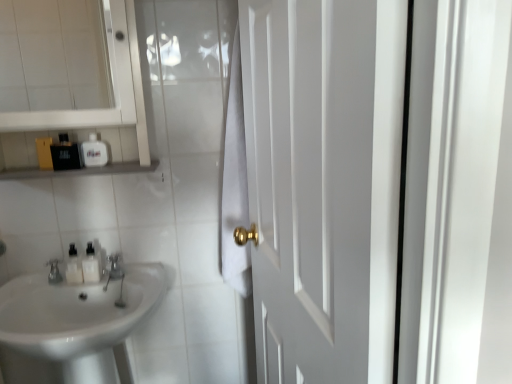
Question: Is matte silver faucet at lower left surrounded by brushed metal faucet at lower left?

Choices:
 (A) no
 (B) yes

Answer: (A)

Question: From a real-world perspective, is brushed metal faucet at lower left below matte silver faucet at lower left?

Choices:
 (A) yes
 (B) no

Answer: (A)

Question: Is there a large distance between brushed metal faucet at lower left and matte silver faucet at lower left?

Choices:
 (A) yes
 (B) no

Answer: (B)

Question: Is the depth of brushed metal faucet at lower left greater than that of matte silver faucet at lower left?

Choices:
 (A) no
 (B) yes

Answer: (B)

Question: Does brushed metal faucet at lower left have a greater height compared to matte silver faucet at lower left?

Choices:
 (A) no
 (B) yes

Answer: (B)

Question: Is matte silver faucet at lower left at the back of brushed metal faucet at lower left?

Choices:
 (A) no
 (B) yes

Answer: (A)

Question: Is white matte door at right outside black plastic container at upper left?

Choices:
 (A) no
 (B) yes

Answer: (B)

Question: From a real-world perspective, is white matte door at right positioned over black plastic container at upper left based on gravity?

Choices:
 (A) yes
 (B) no

Answer: (B)

Question: Is white matte door at right at the right side of black plastic container at upper left?

Choices:
 (A) yes
 (B) no

Answer: (A)

Question: Does white matte door at right have a greater width compared to black plastic container at upper left?

Choices:
 (A) no
 (B) yes

Answer: (A)

Question: Is white matte door at right smaller than black plastic container at upper left?

Choices:
 (A) no
 (B) yes

Answer: (A)

Question: Can you confirm if white matte door at right is shorter than black plastic container at upper left?

Choices:
 (A) yes
 (B) no

Answer: (B)

Question: Is white glossy bottles at left, which is the 1th toiletry from bottom to top, wider than matte black bottle at upper left, which appears as the 1th toiletry when viewed from the top?

Choices:
 (A) no
 (B) yes

Answer: (B)